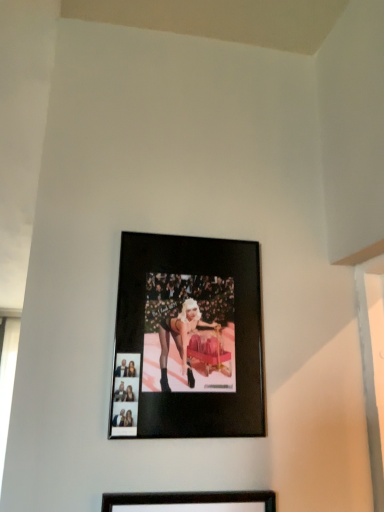
Question: From the image's perspective, is black matte picture frame at center, the 1th picture frame ordered from the bottom, above or below black matte picture frame at center, the first picture frame positioned from the top?

Choices:
 (A) below
 (B) above

Answer: (A)

Question: From a real-world perspective, is black matte picture frame at center, placed as the 2th picture frame when sorted from back to front, above or below black matte picture frame at center, which ranks as the 2th picture frame in bottom-to-top order?

Choices:
 (A) below
 (B) above

Answer: (A)

Question: In terms of height, does black matte picture frame at center, the 1th picture frame ordered from the bottom, look taller or shorter compared to black matte picture frame at center, marked as the first picture frame in a back-to-front arrangement?

Choices:
 (A) short
 (B) tall

Answer: (B)

Question: From a real-world perspective, is black matte picture frame at center, the second picture frame when ordered from front to back, above or below black matte picture frame at center, which ranks as the 1th picture frame in front-to-back order?

Choices:
 (A) below
 (B) above

Answer: (B)

Question: Based on their positions, is black matte picture frame at center, which ranks as the 2th picture frame in bottom-to-top order, located to the left or right of black matte picture frame at center, the 1th picture frame ordered from the bottom?

Choices:
 (A) left
 (B) right

Answer: (B)

Question: Based on their sizes in the image, would you say black matte picture frame at center, which ranks as the 2th picture frame in bottom-to-top order, is bigger or smaller than black matte picture frame at center, placed as the 2th picture frame when sorted from back to front?

Choices:
 (A) small
 (B) big

Answer: (B)

Question: Which is correct: black matte picture frame at center, the first picture frame positioned from the top, is inside black matte picture frame at center, which is the second picture frame from top to bottom, or outside of it?

Choices:
 (A) inside
 (B) outside

Answer: (B)